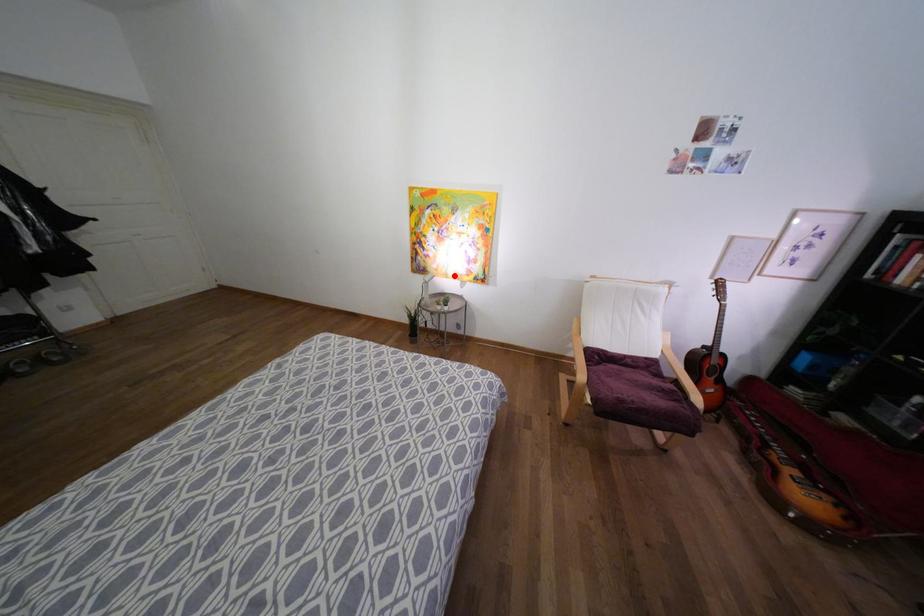
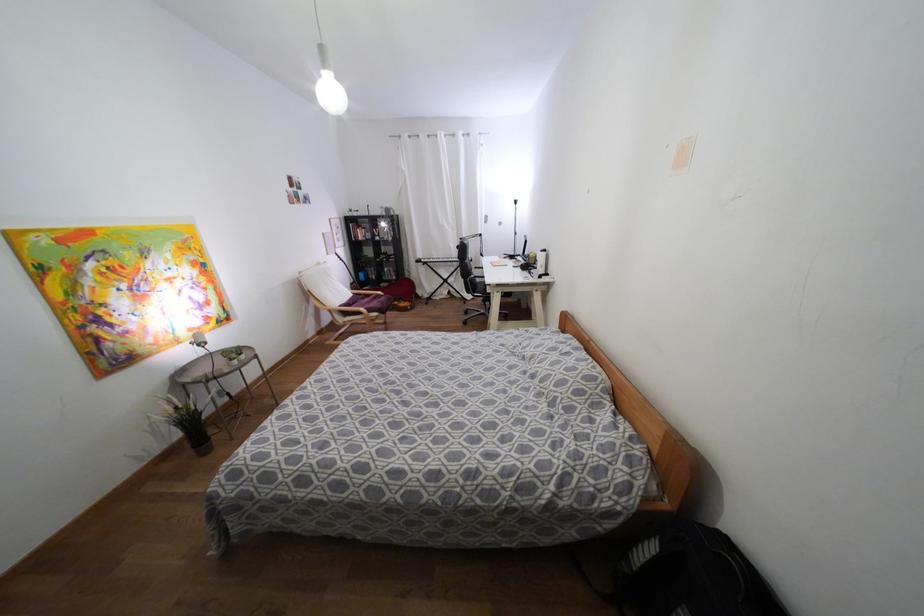
Find the pixel in the second image that matches the highlighted location in the first image.

(190, 333)